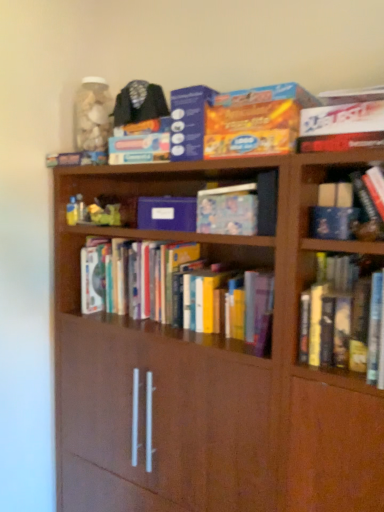
Question: Which direction should I rotate to look at matte cardboard box at upper center, the 2th paperback book when ordered from top to bottom?

Choices:
 (A) right
 (B) left

Answer: (A)

Question: Is matte blue book at center, the first book in the top-to-bottom sequence, facing away from matte cardboard box at upper center, which appears as the first paperback book when viewed from the top?

Choices:
 (A) yes
 (B) no

Answer: (B)

Question: Is matte blue book at center, the first book in the top-to-bottom sequence, next to matte cardboard box at upper center, positioned as the 3th paperback book in bottom-to-top order, and touching it?

Choices:
 (A) no
 (B) yes

Answer: (A)

Question: Is matte blue book at center, the first book in the top-to-bottom sequence, smaller than matte cardboard box at upper center, positioned as the 3th paperback book in bottom-to-top order?

Choices:
 (A) no
 (B) yes

Answer: (B)

Question: Could you tell me if matte blue book at center, the 2th book in the bottom-to-top sequence, is facing matte cardboard box at upper center, which appears as the first paperback book when viewed from the top?

Choices:
 (A) no
 (B) yes

Answer: (A)

Question: Could matte cardboard box at upper center, positioned as the 3th paperback book in bottom-to-top order, be considered to be inside matte blue book at center, the 2th book in the bottom-to-top sequence?

Choices:
 (A) yes
 (B) no

Answer: (B)

Question: Is matte blue book at center, the first book in the top-to-bottom sequence, bigger than matte cardboard box at upper center, positioned as the 3th paperback book in bottom-to-top order?

Choices:
 (A) yes
 (B) no

Answer: (B)

Question: Considering the relative positions of blue matte paper at center, which is the 3th paperback book from top to bottom, and matte cardboard box at upper center, the second paperback book ordered from the bottom, in the image provided, is blue matte paper at center, which is the 3th paperback book from top to bottom, to the left of matte cardboard box at upper center, the second paperback book ordered from the bottom, from the viewer's perspective?

Choices:
 (A) yes
 (B) no

Answer: (A)

Question: Can you confirm if blue matte paper at center, which is the 3th paperback book from top to bottom, is thinner than matte cardboard box at upper center, the 2th paperback book when ordered from top to bottom?

Choices:
 (A) no
 (B) yes

Answer: (B)

Question: From the image's perspective, is blue matte paper at center, the 1th paperback book positioned from the bottom, under matte cardboard box at upper center, the second paperback book ordered from the bottom?

Choices:
 (A) no
 (B) yes

Answer: (B)

Question: Does blue matte paper at center, which is the 3th paperback book from top to bottom, have a lesser height compared to matte cardboard box at upper center, the second paperback book ordered from the bottom?

Choices:
 (A) no
 (B) yes

Answer: (B)

Question: From the image's perspective, would you say blue matte paper at center, which is the 3th paperback book from top to bottom, is positioned over matte cardboard box at upper center, the second paperback book ordered from the bottom?

Choices:
 (A) no
 (B) yes

Answer: (A)

Question: Can you confirm if blue matte paper at center, which is the 3th paperback book from top to bottom, is wider than matte cardboard box at upper center, the second paperback book ordered from the bottom?

Choices:
 (A) yes
 (B) no

Answer: (B)

Question: Is matte cardboard box at upper center, positioned as the 3th paperback book in bottom-to-top order, wider than blue matte paper at center, which is the 3th paperback book from top to bottom?

Choices:
 (A) no
 (B) yes

Answer: (B)